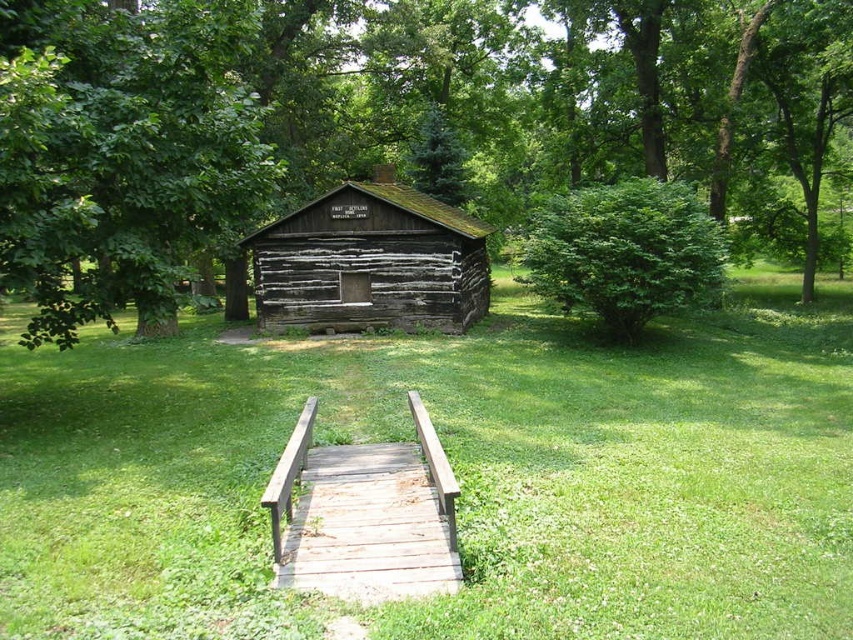
Question: Among these points, which one is nearest to the camera?

Choices:
 (A) (53, 339)
 (B) (842, 344)

Answer: (A)

Question: Which object appears farthest from the camera in this image?

Choices:
 (A) dark brown wooden log cabin at center
 (B) green grass at center
 (C) green leafy tree at center
 (D) weathered wood rail at center

Answer: (A)

Question: Does green leafy tree at center appear over weathered wood rail at center?

Choices:
 (A) no
 (B) yes

Answer: (B)

Question: Considering the relative positions of green grass at center and dark brown wooden log cabin at center in the image provided, where is green grass at center located with respect to dark brown wooden log cabin at center?

Choices:
 (A) above
 (B) below

Answer: (B)

Question: Is green grass at center thinner than weathered wood rail at center?

Choices:
 (A) no
 (B) yes

Answer: (A)

Question: Among these objects, which one is farthest from the camera?

Choices:
 (A) green leafy bush at center right
 (B) dark brown wooden log cabin at center
 (C) green leafy tree at center
 (D) green grass at center

Answer: (B)